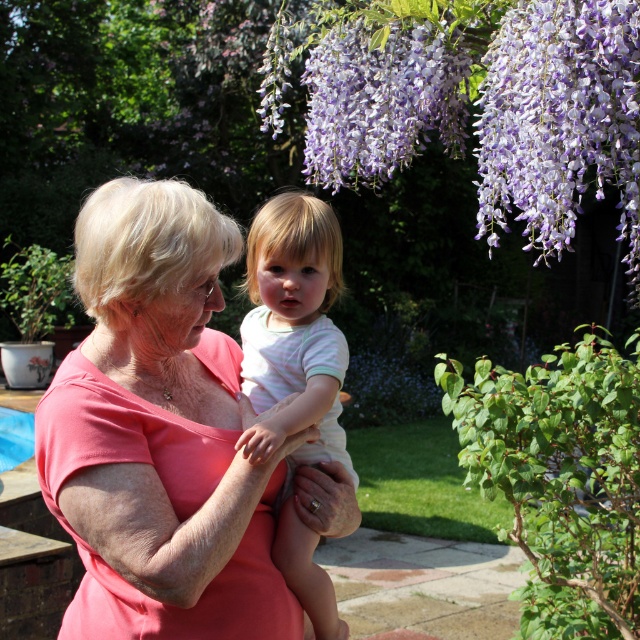
Question: Does white striped shirt at center have a smaller size compared to purple matte flowers at upper center?

Choices:
 (A) yes
 (B) no

Answer: (A)

Question: Is white striped shirt at center wider than purple matte flowers at upper center?

Choices:
 (A) yes
 (B) no

Answer: (B)

Question: Does pink matte shirt at center appear on the right side of white striped shirt at center?

Choices:
 (A) no
 (B) yes

Answer: (A)

Question: Which is nearer to the pink matte shirt at center?

Choices:
 (A) purple matte flowers at upper center
 (B) white striped shirt at center

Answer: (B)

Question: Among these points, which one is nearest to the camera?

Choices:
 (A) (260, 307)
 (B) (333, 134)
 (C) (134, 301)

Answer: (C)

Question: Which point is closer to the camera?

Choices:
 (A) pink matte shirt at center
 (B) white striped shirt at center
 (C) purple matte flowers at upper center

Answer: (A)